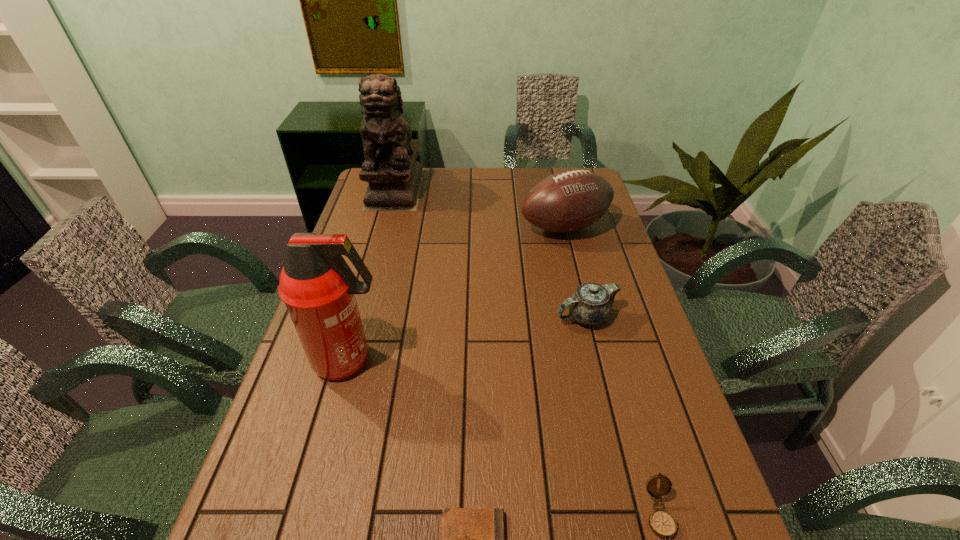
In order to click on blank area in the image that satisfies the following two spatial constraints: 1. on the front-facing side of the sculpture; 2. on the left side of the fourth shortest object in this screenshot , I will do `click(385, 228)`.

You are a GUI agent. You are given a task and a screenshot of the screen. Output one action in this format:
    pyautogui.click(x=<x>, y=<y>)
    Task: Click on the free region that satisfies the following two spatial constraints: 1. on the front-facing side of the fourth shortest object; 2. on the right side of the sculpture
    The image size is (960, 540).
    Given the screenshot: What is the action you would take?
    pyautogui.click(x=385, y=228)